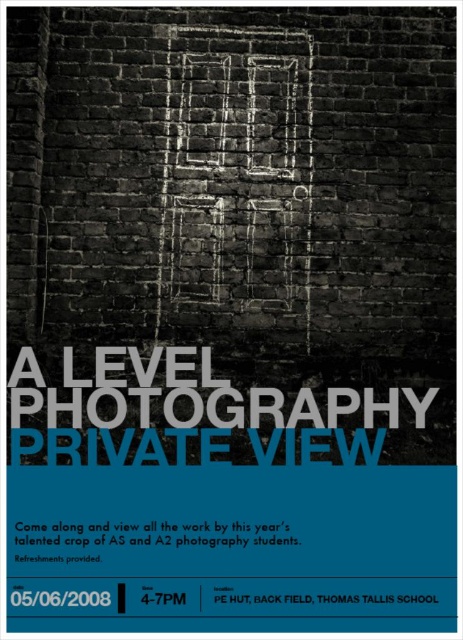
Does white paper at center have a lesser height compared to black paper at lower center?

In fact, white paper at center may be taller than black paper at lower center.

Does white paper at center appear on the left side of black paper at lower center?

Incorrect, white paper at center is not on the left side of black paper at lower center.

This screenshot has height=640, width=463. I want to click on white paper at center, so click(188, 412).